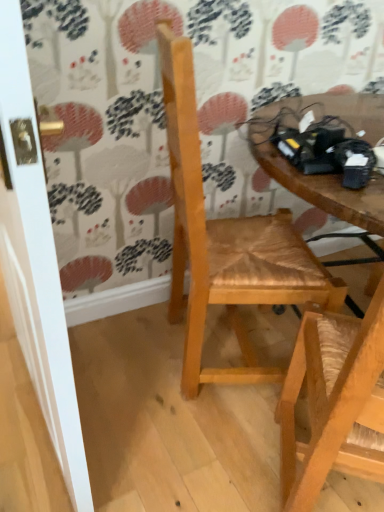
In order to face natural wood chair at center, should I rotate leftwards or rightwards?

To face it directly, rotate right by 6.564 degrees.

The height and width of the screenshot is (512, 384). In order to click on natural wood chair at center in this screenshot , I will do `click(226, 242)`.

This screenshot has height=512, width=384. What do you see at coordinates (226, 242) in the screenshot?
I see `natural wood chair at center` at bounding box center [226, 242].

At what (x,y) coordinates should I click in order to perform the action: click on natural wood chair at center. Please return your answer as a coordinate pair (x, y). Looking at the image, I should click on (226, 242).